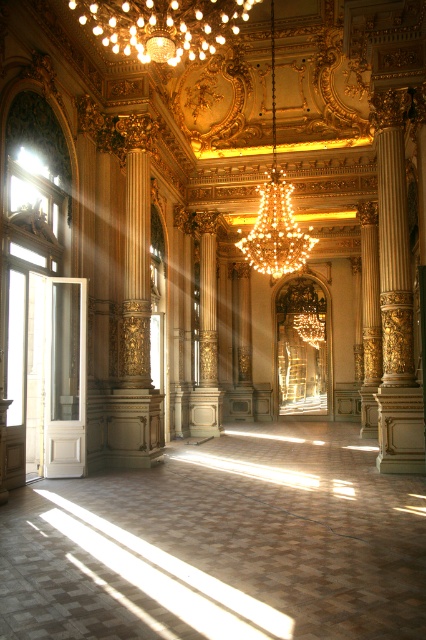
Is point (146, 56) in front of point (305, 257)?

Yes, it is.

Is point (183, 29) farther from viewer compared to point (270, 36)?

No, it is not.

Where is `gold crystal chandelier at upper center`? gold crystal chandelier at upper center is located at coordinates (163, 26).

From the picture: Is gold crystal chandelier at center further to camera compared to smooth cream-colored column at center?

No, it is in front of smooth cream-colored column at center.

Does point (279, 260) come behind point (210, 353)?

No, (279, 260) is closer to viewer.

What do you see at coordinates (276, 212) in the screenshot? I see `gold crystal chandelier at center` at bounding box center [276, 212].

Identify the location of gold crystal chandelier at center. The width and height of the screenshot is (426, 640). (276, 212).

Image resolution: width=426 pixels, height=640 pixels. Describe the element at coordinates (163, 26) in the screenshot. I see `gold crystal chandelier at upper center` at that location.

Is gold crystal chandelier at upper center closer to camera compared to smooth cream-colored column at center?

Answer: Yes, it is.

Where is `gold crystal chandelier at upper center`? gold crystal chandelier at upper center is located at coordinates (163, 26).